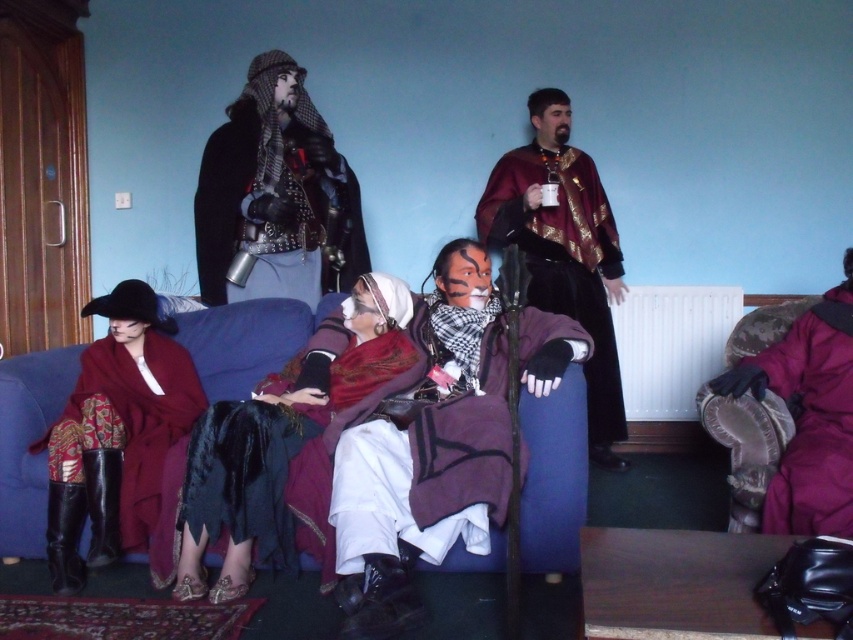
Question: Estimate the real-world distances between objects in this image. Which object is farther from the shiny black leather jacket at upper center?

Choices:
 (A) matte black mask at center
 (B) blue fabric couch at center
 (C) velvet maroon coat at lower left
 (D) velvet maroon cape at center

Answer: (A)

Question: Which object is positioned closest to the velvet maroon coat at lower left?

Choices:
 (A) shiny black leather jacket at upper center
 (B) matte black mask at center
 (C) purple matte helmet at right
 (D) velvet maroon cape at center

Answer: (A)

Question: Based on their relative distances, which object is farther from the matte black mask at center?

Choices:
 (A) blue fabric couch at center
 (B) velvet burgundy dress at center
 (C) velvet maroon cape at center

Answer: (A)

Question: Can you confirm if matte black mask at center is smaller than velvet maroon cape at center?

Choices:
 (A) yes
 (B) no

Answer: (B)

Question: Is velvet burgundy dress at center thinner than velvet maroon coat at lower left?

Choices:
 (A) yes
 (B) no

Answer: (B)

Question: Is blue fabric couch at center below velvet maroon coat at lower left?

Choices:
 (A) no
 (B) yes

Answer: (B)